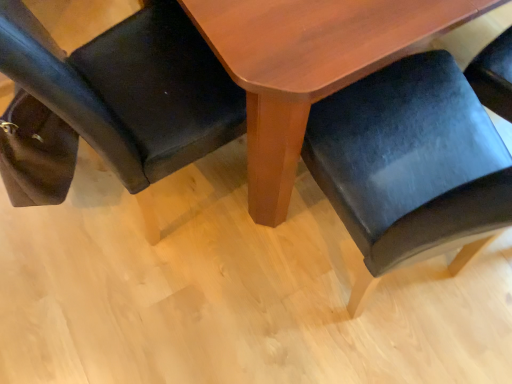
Where is `vacant space underneath velvet black chair at lower right, acting as the 2th chair starting from the left (from a real-world perspective)`? The width and height of the screenshot is (512, 384). vacant space underneath velvet black chair at lower right, acting as the 2th chair starting from the left (from a real-world perspective) is located at coordinates (380, 280).